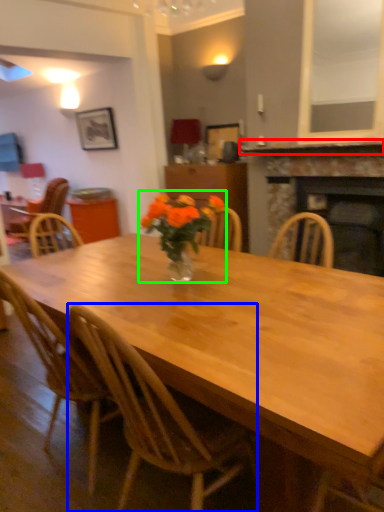
Question: Estimate the real-world distances between objects in this image. Which object is farther from mantle (highlighted by a red box), chair (highlighted by a blue box) or floral arrangement (highlighted by a green box)?

Choices:
 (A) chair
 (B) floral arrangement

Answer: (A)